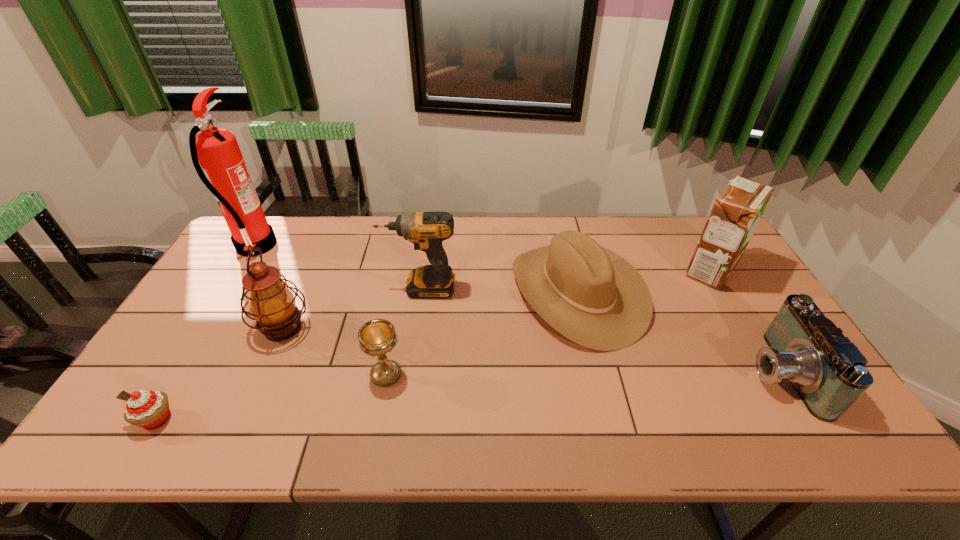
Locate an element on the screen. The image size is (960, 540). free space located 0.350m on the straw side of the carton is located at coordinates (570, 270).

The image size is (960, 540). In order to click on vacant area situated on the straw side of the carton in this screenshot , I will do `click(583, 270)`.

Where is `vacant space situated 0.160m on the left of the sixth object from right to left`? This screenshot has width=960, height=540. vacant space situated 0.160m on the left of the sixth object from right to left is located at coordinates (196, 328).

The width and height of the screenshot is (960, 540). In order to click on free space located with the drill bit of the drill facing forward in this screenshot , I will do tap(348, 288).

Identify the location of vacant region located 0.360m with the drill bit of the drill facing forward. (266, 288).

Where is `vacant position located with the drill bit of the drill facing forward`? vacant position located with the drill bit of the drill facing forward is located at coordinates (285, 288).

You are a GUI agent. You are given a task and a screenshot of the screen. Output one action in this format:
    pyautogui.click(x=<x>, y=<y>)
    Task: Click on the vacant space located 0.090m on the left of the cowboy hat
    Image resolution: width=960 pixels, height=540 pixels.
    Given the screenshot: What is the action you would take?
    click(x=483, y=292)

Identify the location of vacant space located 0.320m on the front-facing side of the camcorder. The image size is (960, 540). (619, 373).

Find the location of a particular element. vacant region located 0.330m on the front-facing side of the camcorder is located at coordinates tap(615, 373).

Locate an element on the screen. The height and width of the screenshot is (540, 960). free location located 0.300m on the front-facing side of the camcorder is located at coordinates (627, 373).